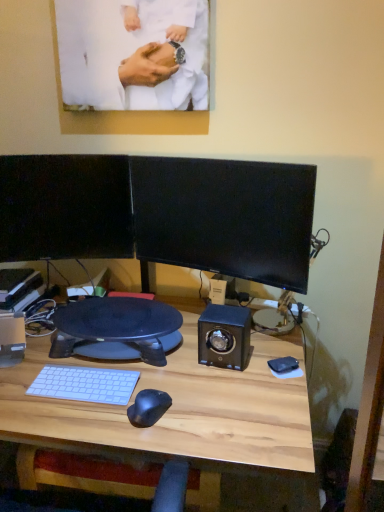
Question: Should I look upward or downward to see matte white shirt at upper center?

Choices:
 (A) down
 (B) up

Answer: (B)